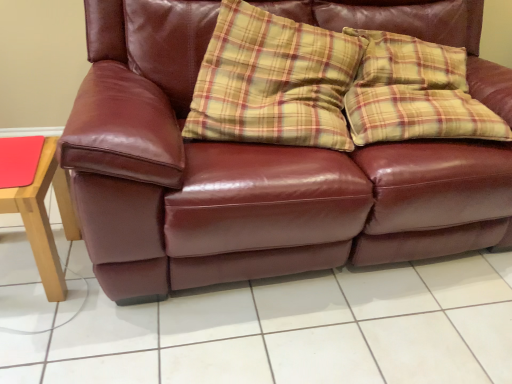
Question: Should I look upward or downward to see matte wood table at left?

Choices:
 (A) up
 (B) down

Answer: (B)

Question: From the image's perspective, is burgundy leather couch at center beneath matte leather couch at center?

Choices:
 (A) no
 (B) yes

Answer: (A)

Question: Does burgundy leather couch at center have a smaller size compared to matte leather couch at center?

Choices:
 (A) no
 (B) yes

Answer: (A)

Question: Is burgundy leather couch at center surrounding matte leather couch at center?

Choices:
 (A) no
 (B) yes

Answer: (A)

Question: Can you confirm if burgundy leather couch at center is bigger than matte leather couch at center?

Choices:
 (A) yes
 (B) no

Answer: (A)

Question: Does burgundy leather couch at center have a lesser height compared to matte leather couch at center?

Choices:
 (A) no
 (B) yes

Answer: (A)

Question: Is burgundy leather couch at center positioned before matte leather couch at center?

Choices:
 (A) no
 (B) yes

Answer: (B)

Question: Is matte wood table at left taller than matte leather couch at center?

Choices:
 (A) no
 (B) yes

Answer: (B)

Question: Can you confirm if matte wood table at left is wider than matte leather couch at center?

Choices:
 (A) no
 (B) yes

Answer: (A)

Question: Is matte wood table at left at the right side of matte leather couch at center?

Choices:
 (A) no
 (B) yes

Answer: (A)

Question: Can matte leather couch at center be found inside matte wood table at left?

Choices:
 (A) yes
 (B) no

Answer: (B)

Question: Is matte wood table at left placed right next to matte leather couch at center?

Choices:
 (A) yes
 (B) no

Answer: (B)

Question: Would you say matte wood table at left is a long distance from matte leather couch at center?

Choices:
 (A) no
 (B) yes

Answer: (A)

Question: Does matte wood table at left have a larger size compared to burgundy leather couch at center?

Choices:
 (A) no
 (B) yes

Answer: (A)